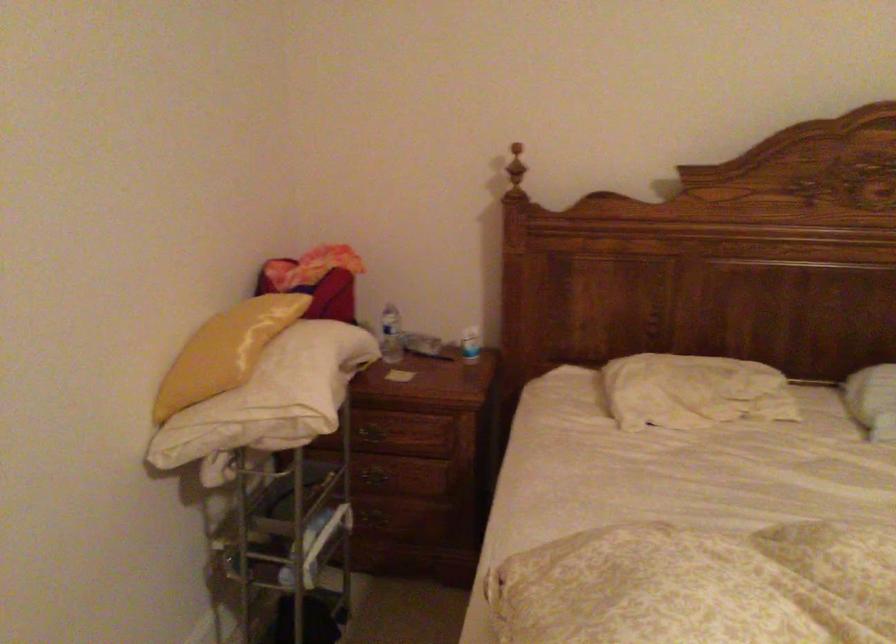
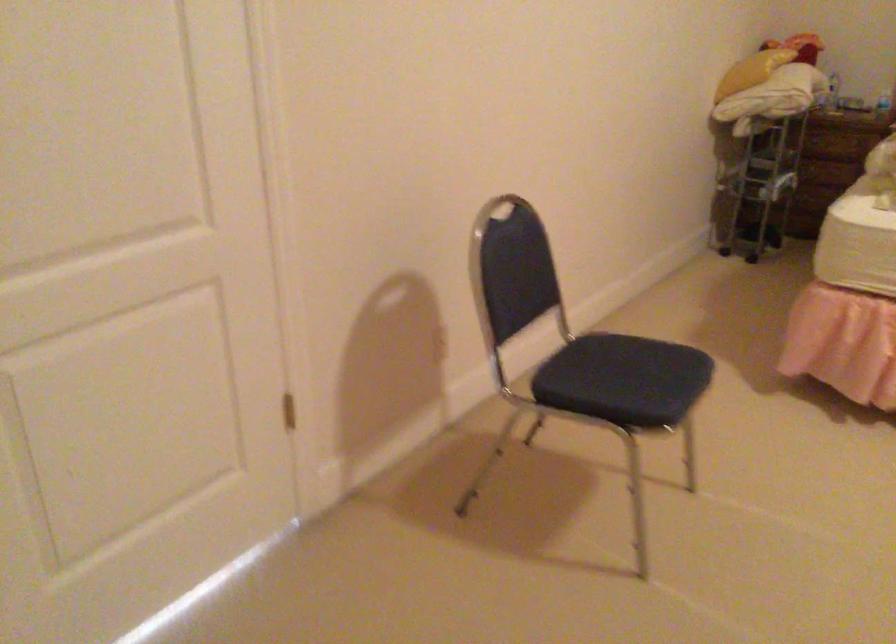
Question: The images are taken continuously from a first-person perspective. In which direction are you moving?

Choices:
 (A) Left
 (B) Right
 (C) Forward
 (D) Backward

Answer: (D)